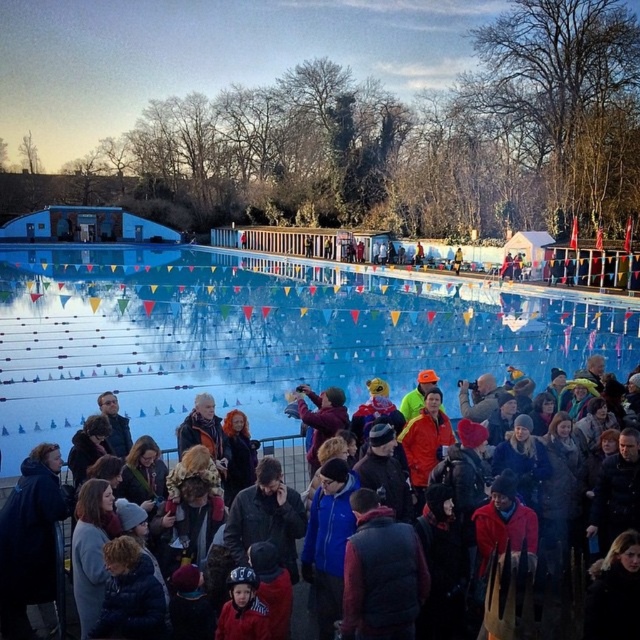
Which of these two, blue smooth water at center or dark blue fabric crowd at lower center, stands taller?

blue smooth water at center is taller.

Can you confirm if blue smooth water at center is positioned above dark blue fabric crowd at lower center?

Yes.

Who is more forward, (128, 332) or (289, 452)?

Point (289, 452) is in front.

The width and height of the screenshot is (640, 640). In order to click on blue smooth water at center in this screenshot , I will do `click(260, 333)`.